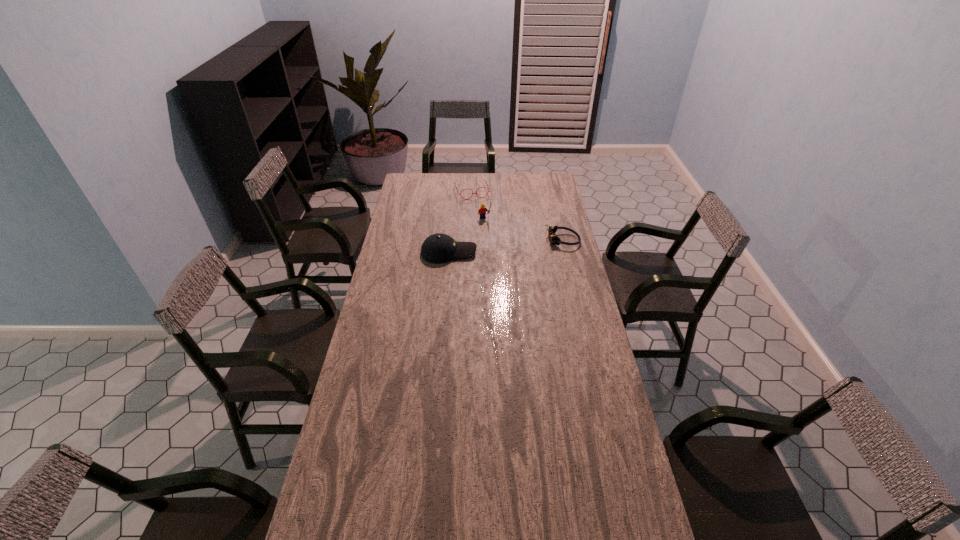
The image size is (960, 540). Identify the location of the second tallest object. (438, 248).

This screenshot has width=960, height=540. What are the coordinates of `the rightmost object` in the screenshot? It's located at (553, 238).

This screenshot has width=960, height=540. In order to click on spectacles in this screenshot , I will do `click(483, 180)`.

The image size is (960, 540). Find the location of `the third nearest object`. the third nearest object is located at coordinates (482, 211).

Image resolution: width=960 pixels, height=540 pixels. What are the coordinates of `Lego` in the screenshot? It's located at pyautogui.click(x=482, y=211).

This screenshot has width=960, height=540. In order to click on free spot located on the front-facing side of the baseball cap in this screenshot , I will do click(493, 252).

The image size is (960, 540). I want to click on free location located on the front-facing side of the farthest object, so click(x=478, y=207).

Locate an element on the screen. The width and height of the screenshot is (960, 540). free spot located on the front-facing side of the farthest object is located at coordinates (478, 206).

The width and height of the screenshot is (960, 540). In order to click on vacant space located 0.110m on the front-facing side of the farthest object in this screenshot , I will do `click(480, 211)`.

Where is `free space located 0.360m on the front-facing side of the second farthest object`? free space located 0.360m on the front-facing side of the second farthest object is located at coordinates (517, 263).